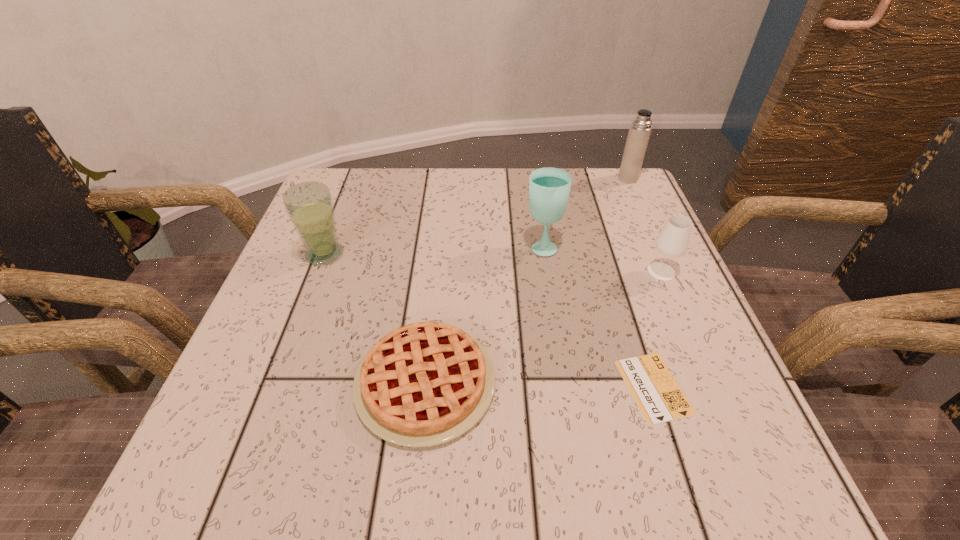
Where is `vacant area that lies between the shortest glass and the leftmost glass`? The height and width of the screenshot is (540, 960). vacant area that lies between the shortest glass and the leftmost glass is located at coordinates (493, 263).

Where is `vacant area that lies between the leftmost object and the thermos bottle`? This screenshot has height=540, width=960. vacant area that lies between the leftmost object and the thermos bottle is located at coordinates (476, 217).

At what (x,y) coordinates should I click in order to perform the action: click on free space that is in between the identity card and the third shortest object. Please return your answer as a coordinate pair (x, y). The image size is (960, 540). Looking at the image, I should click on (658, 329).

You are a GUI agent. You are given a task and a screenshot of the screen. Output one action in this format:
    pyautogui.click(x=<x>, y=<y>)
    Task: Click on the vacant area between the second object from left to right and the shortest object
    The width and height of the screenshot is (960, 540).
    Given the screenshot: What is the action you would take?
    pyautogui.click(x=540, y=385)

Locate an element on the screen. The width and height of the screenshot is (960, 540). empty space that is in between the farthest object and the shortest glass is located at coordinates (644, 225).

You are a GUI agent. You are given a task and a screenshot of the screen. Output one action in this format:
    pyautogui.click(x=<x>, y=<y>)
    Task: Click on the free space between the thermos bottle and the fourth object from right to left
    This screenshot has width=960, height=540.
    Given the screenshot: What is the action you would take?
    (585, 212)

This screenshot has height=540, width=960. What are the coordinates of `free space between the leftmost glass and the shortest object` in the screenshot? It's located at tap(489, 321).

At what (x,y) coordinates should I click in order to perform the action: click on object that stands as the third closest to the fifth object from right to left. Please return your answer as a coordinate pair (x, y). Image resolution: width=960 pixels, height=540 pixels. Looking at the image, I should click on (549, 188).

Choose which object is the second nearest neighbor to the shortest object. Please provide its 2D coordinates. Your answer should be formatted as a tuple, i.e. [(x, y)], where the tuple contains the x and y coordinates of a point satisfying the conditions above.

[(423, 384)]

Identify the location of glass that is the second closest to the shortest glass. (309, 205).